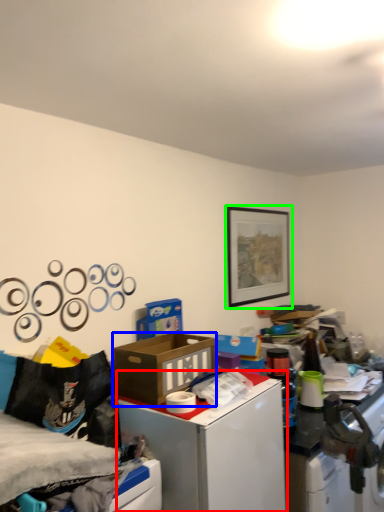
Question: Based on their relative distances, which object is nearer to table (highlighted by a red box)? Choose from box (highlighted by a blue box) and picture frame (highlighted by a green box).

Choices:
 (A) box
 (B) picture frame

Answer: (A)